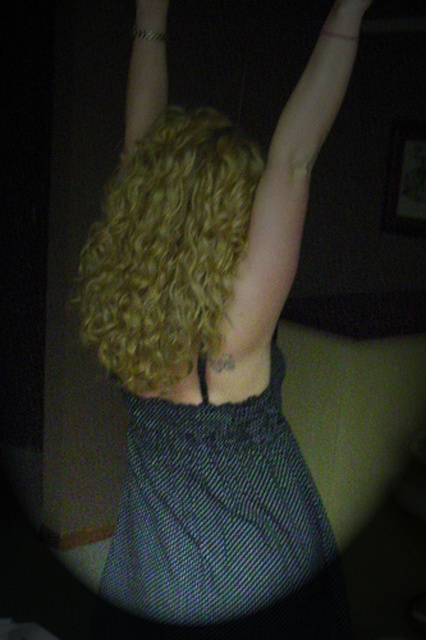
Question: Which of the following is the farthest from the observer?

Choices:
 (A) textured black dress at center
 (B) matte black hand at upper center
 (C) metallic bracelet at upper center

Answer: (C)

Question: Is smooth skin arm at upper center smaller than matte black hand at upper center?

Choices:
 (A) no
 (B) yes

Answer: (A)

Question: Does textured black dress at center have a lesser width compared to curly blonde hair at center?

Choices:
 (A) yes
 (B) no

Answer: (B)

Question: Where is curly blonde hair at center located in relation to metallic bracelet at upper center in the image?

Choices:
 (A) left
 (B) right

Answer: (B)

Question: Based on their relative distances, which object is farther from the matte black hand at upper center?

Choices:
 (A) metallic bracelet at upper center
 (B) smooth skin arm at upper center
 (C) curly blonde hair at center

Answer: (A)

Question: Which object appears closest to the camera in this image?

Choices:
 (A) curly blonde hair at center
 (B) textured black dress at center

Answer: (A)